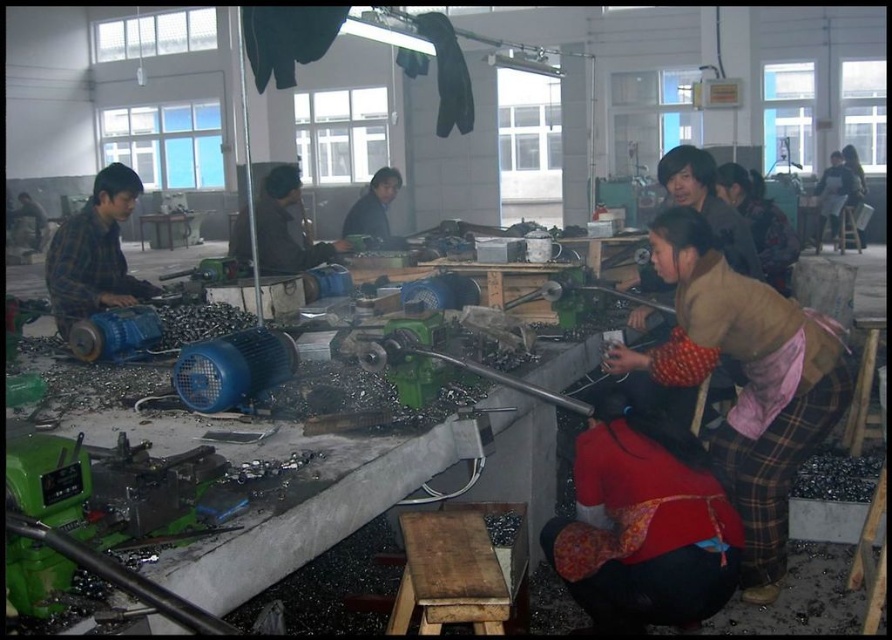
You are a delivery person who needs to place a 2.5 meter long box between the brown plaid pants at lower right and the matte black shirt at center. Can the box fit in the space between them?

The distance between the brown plaid pants at lower right and the matte black shirt at center is 3.62 meters. Since the box is 2.5 meters long, it can fit comfortably within the available space.

You are an inspector in the workshop. You need to determine which of the two items, the brown plaid pants at lower right or the matte black shirt at center, is bigger in size. Which one is larger?

The brown plaid pants at lower right is larger in size than the matte black shirt at center.